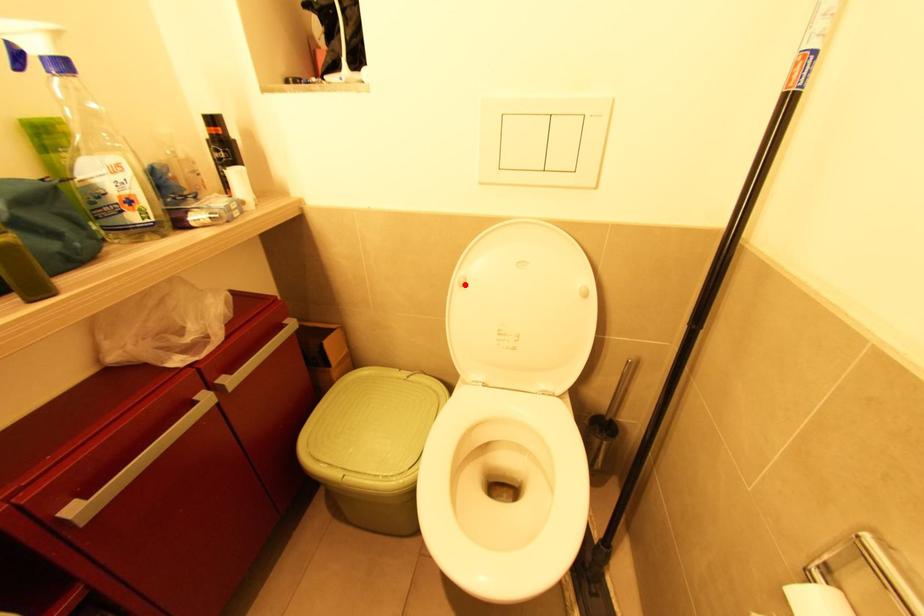
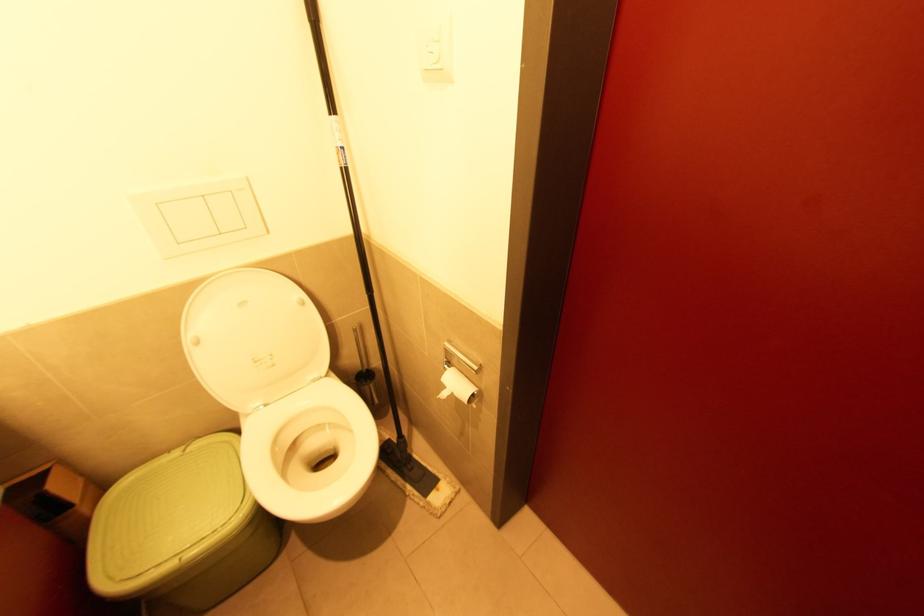
The point at the highlighted location is marked in the first image. Where is the corresponding point in the second image?

(200, 342)